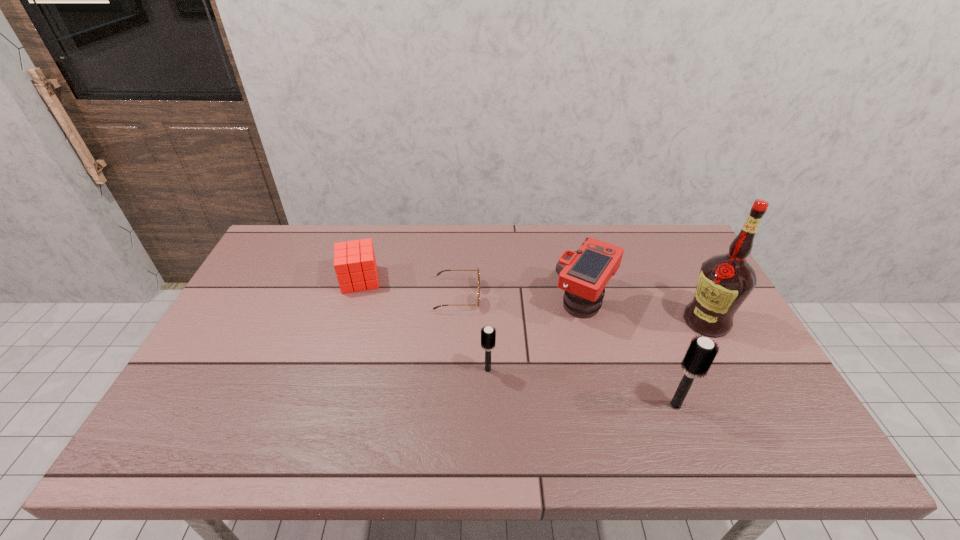
Where is `free space for a new hairbrush on the left`? free space for a new hairbrush on the left is located at coordinates (324, 339).